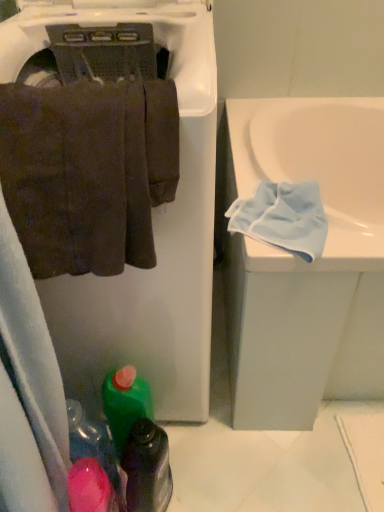
Question: Is green plastic bottle at lower center, acting as the 2th bottle starting from the left, looking in the opposite direction of green plastic bottle at lower center, acting as the 1th bottle starting from the left?

Choices:
 (A) no
 (B) yes

Answer: (B)

Question: Is green plastic bottle at lower center, acting as the 2th bottle starting from the left, taller than green plastic bottle at lower center, marked as the 2th bottle in a right-to-left arrangement?

Choices:
 (A) no
 (B) yes

Answer: (A)

Question: From a real-world perspective, is green plastic bottle at lower center, acting as the 2th bottle starting from the left, over green plastic bottle at lower center, acting as the 1th bottle starting from the left?

Choices:
 (A) yes
 (B) no

Answer: (B)

Question: Is green plastic bottle at lower center, acting as the 2th bottle starting from the left, shorter than green plastic bottle at lower center, acting as the 1th bottle starting from the left?

Choices:
 (A) no
 (B) yes

Answer: (B)

Question: Is green plastic bottle at lower center, acting as the 2th bottle starting from the left, wider than green plastic bottle at lower center, marked as the 2th bottle in a right-to-left arrangement?

Choices:
 (A) no
 (B) yes

Answer: (B)

Question: In terms of width, does green plastic bottle at lower center, placed as the 1th bottle when sorted from right to left, look wider or thinner when compared to light blue microfiber cloth at right?

Choices:
 (A) thin
 (B) wide

Answer: (A)

Question: Is point (150, 498) closer or farther from the camera than point (314, 216)?

Choices:
 (A) closer
 (B) farther

Answer: (B)

Question: From a real-world perspective, is green plastic bottle at lower center, placed as the 1th bottle when sorted from right to left, positioned above or below light blue microfiber cloth at right?

Choices:
 (A) below
 (B) above

Answer: (A)

Question: Is green plastic bottle at lower center, acting as the 2th bottle starting from the left, to the left or to the right of light blue microfiber cloth at right in the image?

Choices:
 (A) left
 (B) right

Answer: (A)

Question: Considering the positions of brown cotton towel at left and light blue microfiber cloth at right in the image, is brown cotton towel at left taller or shorter than light blue microfiber cloth at right?

Choices:
 (A) tall
 (B) short

Answer: (A)

Question: Does point tap(107, 92) appear closer or farther from the camera than point tap(317, 250)?

Choices:
 (A) closer
 (B) farther

Answer: (A)

Question: Looking at their shapes, would you say brown cotton towel at left is wider or thinner than light blue microfiber cloth at right?

Choices:
 (A) thin
 (B) wide

Answer: (A)

Question: Visually, is brown cotton towel at left positioned to the left or to the right of light blue microfiber cloth at right?

Choices:
 (A) left
 (B) right

Answer: (A)

Question: From the image's perspective, relative to white matte dishwasher at upper left, is brown cotton towel at left above or below?

Choices:
 (A) above
 (B) below

Answer: (A)

Question: Is brown cotton towel at left wider or thinner than white matte dishwasher at upper left?

Choices:
 (A) thin
 (B) wide

Answer: (A)